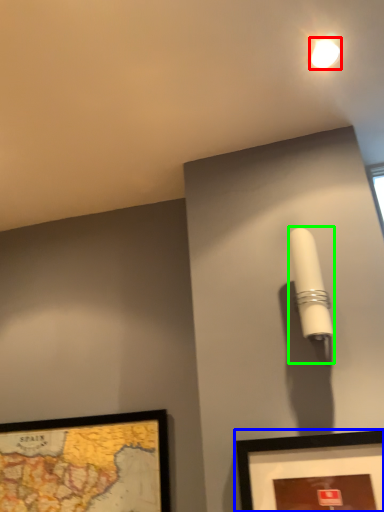
Question: Estimate the real-world distances between objects in this image. Which object is closer to droplight (highlighted by a red box), picture frame (highlighted by a blue box) or table lamp (highlighted by a green box)?

Choices:
 (A) picture frame
 (B) table lamp

Answer: (B)